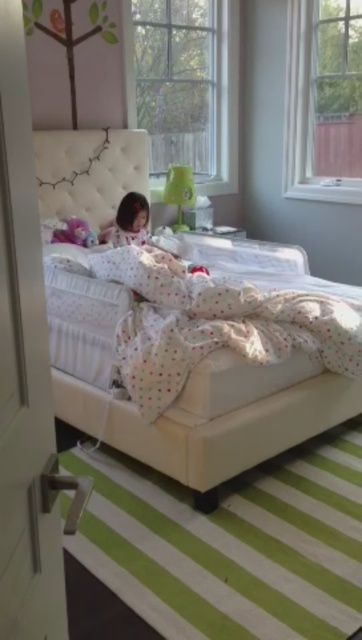
You are a parent looking for your child who is hiding in the bedroom. You see the white tufted bed at center and the white tufted headboard at upper center. Which object is larger and might be a better place to check?

The white tufted bed at center is bigger than the white tufted headboard at upper center, so it is a better place to check.

You are a parent looking for a place to put a new toy box that is the same size as the soft plush toy at lower left. Can you fit the toy box next to the white tufted bed at center without moving the bed?

The white tufted bed at center is wider than the soft plush toy at lower left, so there should be enough space to fit the toy box next to the white tufted bed at center without moving it.